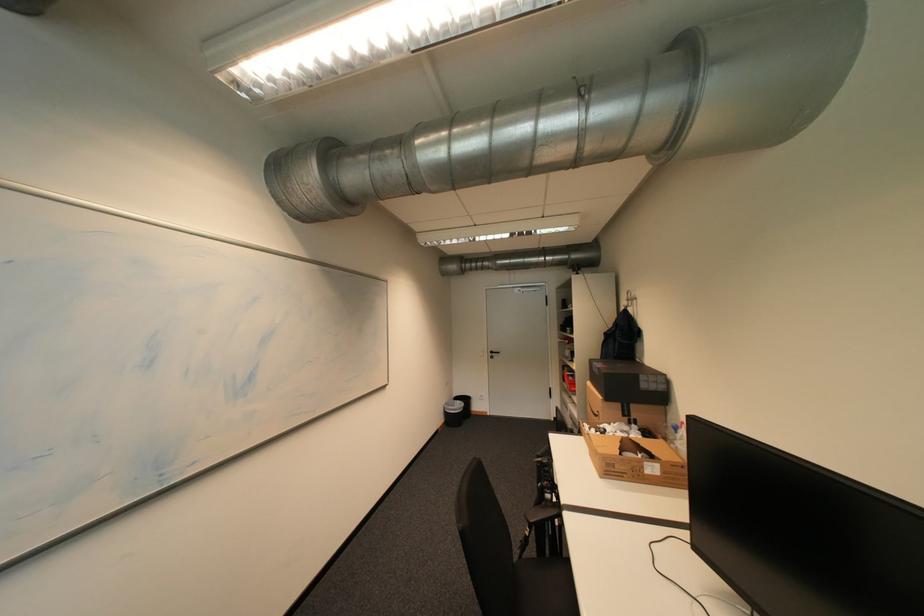
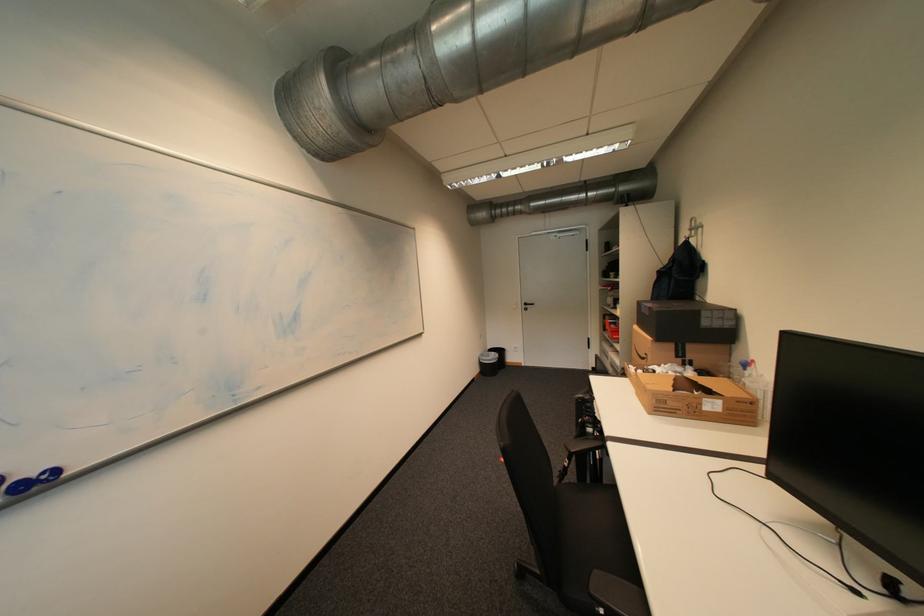
Question: The images are taken continuously from a first-person perspective. In which direction is your viewpoint rotating?

Choices:
 (A) Left
 (B) Right
 (C) Up
 (D) Down

Answer: (D)